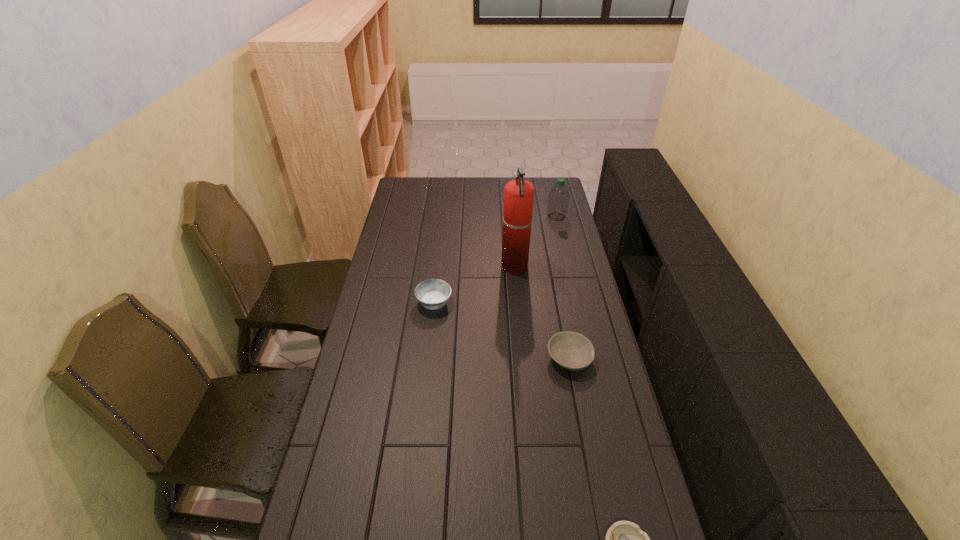
At what (x,y) coordinates should I click in order to perform the action: click on blank area in the image that satisfies the following two spatial constraints: 1. on the back side of the water bottle; 2. on the left side of the fourth tallest object. Please return your answer as a coordinate pair (x, y). Image resolution: width=960 pixels, height=540 pixels. Looking at the image, I should click on (542, 217).

Image resolution: width=960 pixels, height=540 pixels. In order to click on free location that satisfies the following two spatial constraints: 1. on the front side of the taller ashtray; 2. on the right side of the bowl in this screenshot , I will do `click(428, 358)`.